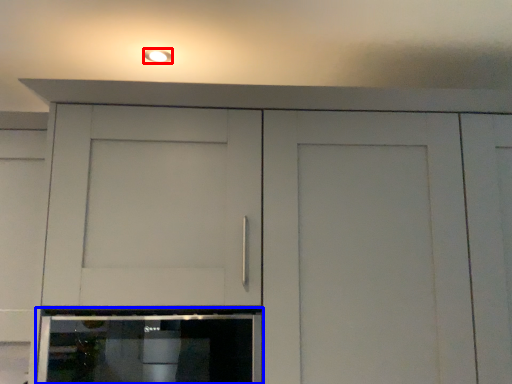
Question: Which of the following is the farthest to the observer, lighting (highlighted by a red box) or home appliance (highlighted by a blue box)?

Choices:
 (A) lighting
 (B) home appliance

Answer: (A)